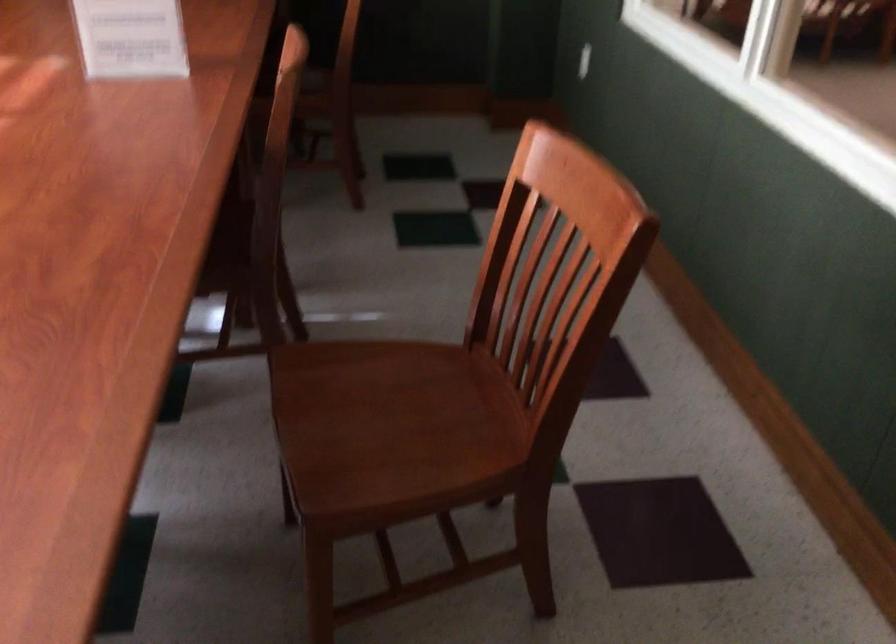
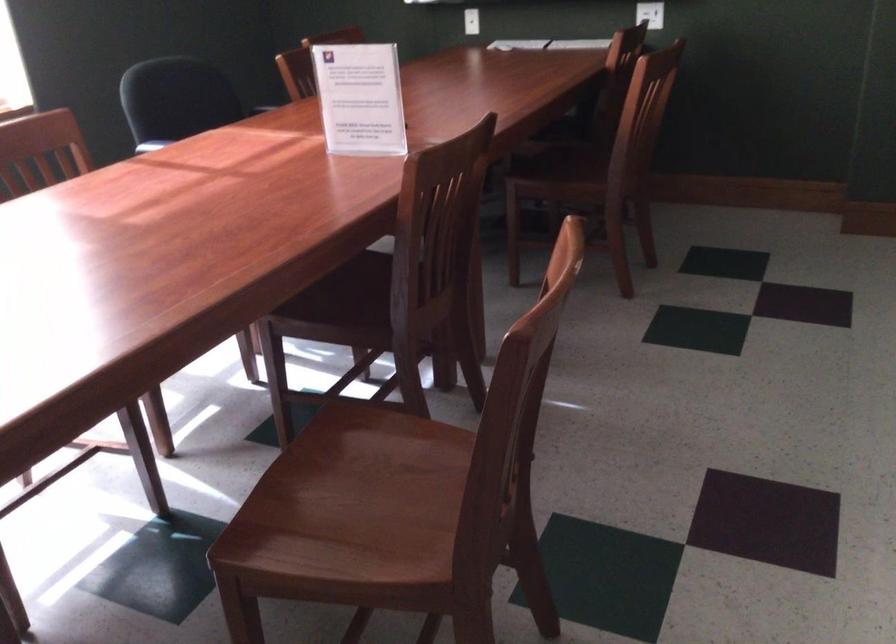
Where in the second image is the point corresponding to (391,429) from the first image?

(351, 504)